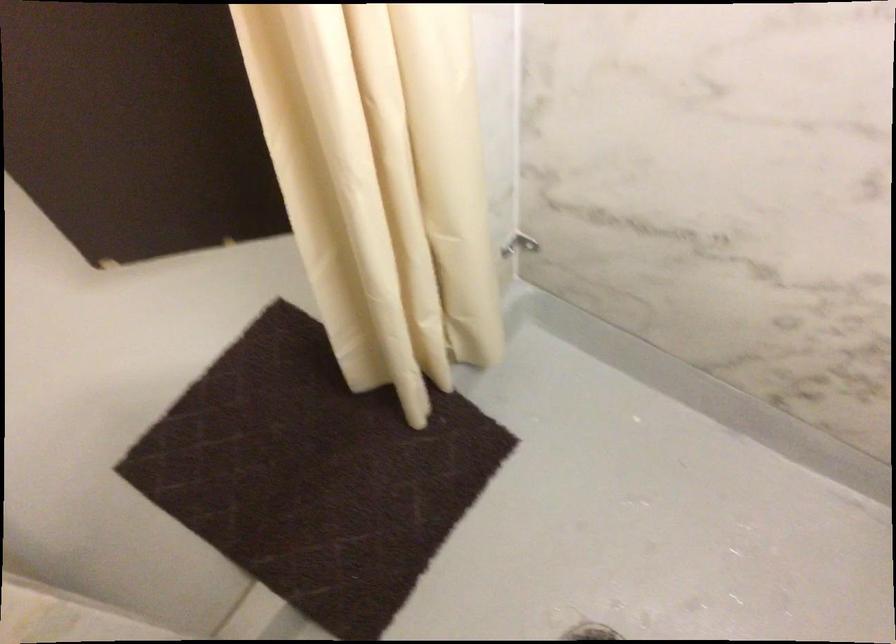
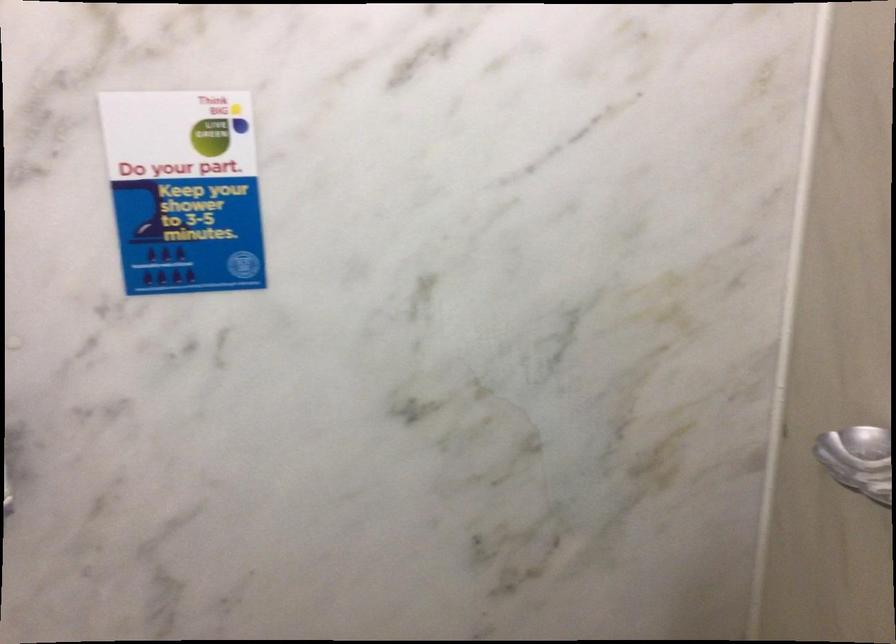
Question: What movement of the cameraman would produce the second image?

Choices:
 (A) Left
 (B) Right
 (C) Forward
 (D) Backward

Answer: (D)